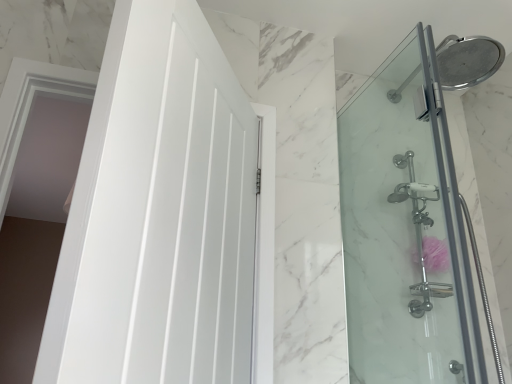
Question: From a real-world perspective, is clear glass shower door at right on white glossy door at left?

Choices:
 (A) yes
 (B) no

Answer: (A)

Question: Is clear glass shower door at right positioned before white glossy door at left?

Choices:
 (A) yes
 (B) no

Answer: (B)

Question: Considering the relative positions of clear glass shower door at right and white glossy door at left in the image provided, is clear glass shower door at right to the right of white glossy door at left from the viewer's perspective?

Choices:
 (A) yes
 (B) no

Answer: (A)

Question: Considering the relative positions of clear glass shower door at right and white glossy door at left in the image provided, is clear glass shower door at right to the left of white glossy door at left from the viewer's perspective?

Choices:
 (A) yes
 (B) no

Answer: (B)

Question: Is clear glass shower door at right oriented towards white glossy door at left?

Choices:
 (A) yes
 (B) no

Answer: (A)

Question: From the image's perspective, is clear glass shower door at right located above white glossy door at left?

Choices:
 (A) yes
 (B) no

Answer: (B)

Question: Is white glossy door at left oriented towards clear glass shower door at right?

Choices:
 (A) yes
 (B) no

Answer: (B)

Question: Does white glossy door at left contain clear glass shower door at right?

Choices:
 (A) yes
 (B) no

Answer: (B)

Question: Considering the relative sizes of white glossy door at left and clear glass shower door at right in the image provided, is white glossy door at left taller than clear glass shower door at right?

Choices:
 (A) yes
 (B) no

Answer: (B)

Question: Is white glossy door at left at the left side of clear glass shower door at right?

Choices:
 (A) no
 (B) yes

Answer: (B)

Question: From a real-world perspective, is white glossy door at left beneath clear glass shower door at right?

Choices:
 (A) yes
 (B) no

Answer: (A)

Question: From the image's perspective, is white glossy door at left on clear glass shower door at right?

Choices:
 (A) yes
 (B) no

Answer: (A)

Question: Considering the positions of white glossy door at left and clear glass shower door at right in the image, is white glossy door at left wider or thinner than clear glass shower door at right?

Choices:
 (A) wide
 (B) thin

Answer: (A)